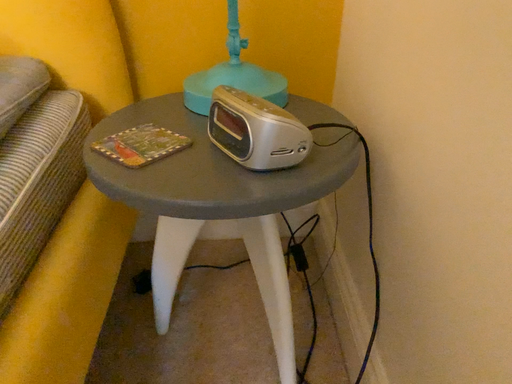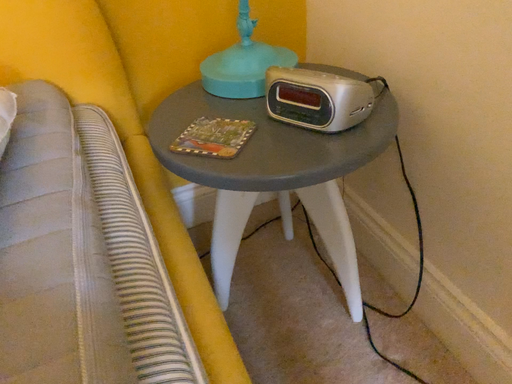
Question: How did the camera likely rotate when shooting the video?

Choices:
 (A) rotated right
 (B) rotated left

Answer: (A)